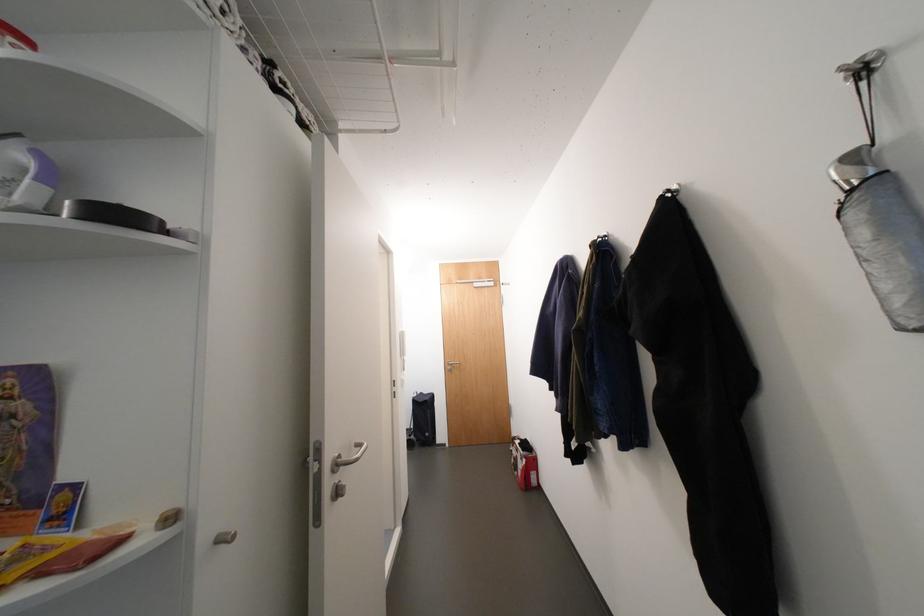
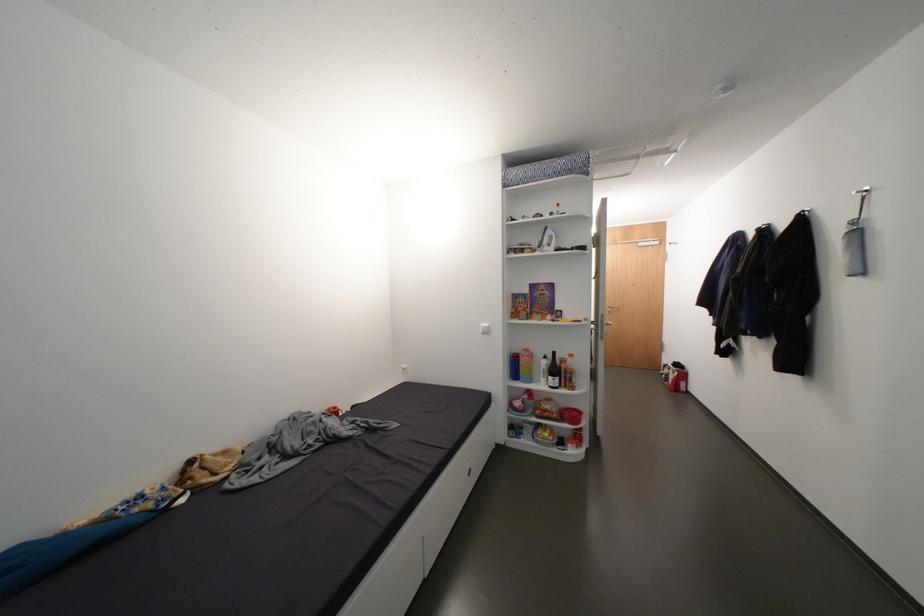
The point at [532,462] is marked in the first image. Where is the corresponding point in the second image?

(684, 374)